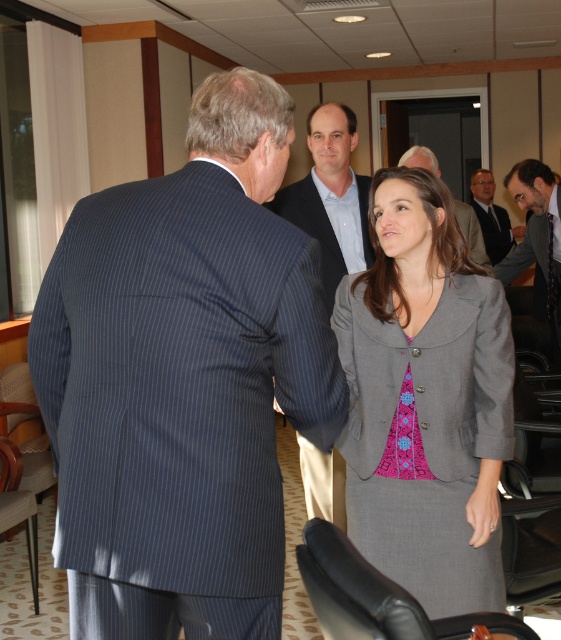
Can you confirm if blue pinstripe suit at center is smaller than gray suit at center?

No.

Looking at this image, between blue pinstripe suit at center and gray suit at center, which one has more height?

Standing taller between the two is blue pinstripe suit at center.

The width and height of the screenshot is (561, 640). I want to click on blue pinstripe suit at center, so click(x=330, y=196).

At what (x,y) coordinates should I click in order to perform the action: click on blue pinstripe suit at center. Please return your answer as a coordinate pair (x, y). Looking at the image, I should click on (330, 196).

Measure the distance between gray fabric jacket at center and camera.

gray fabric jacket at center is 7.11 feet away from camera.

Does gray fabric jacket at center appear under gray fabric suit at center?

Yes, gray fabric jacket at center is below gray fabric suit at center.

The width and height of the screenshot is (561, 640). What do you see at coordinates (425, 401) in the screenshot? I see `gray fabric jacket at center` at bounding box center [425, 401].

Where is `gray fabric jacket at center`? This screenshot has height=640, width=561. gray fabric jacket at center is located at coordinates [425, 401].

Consider the image. Does dark blue pinstripe suit at left have a lesser height compared to gray fabric jacket at center?

No.

Does dark blue pinstripe suit at left have a larger size compared to gray fabric jacket at center?

Yes, dark blue pinstripe suit at left is bigger than gray fabric jacket at center.

Is point (89, 417) farther from viewer compared to point (411, 452)?

No.

Where is `dark blue pinstripe suit at left`? This screenshot has height=640, width=561. dark blue pinstripe suit at left is located at coordinates (183, 380).